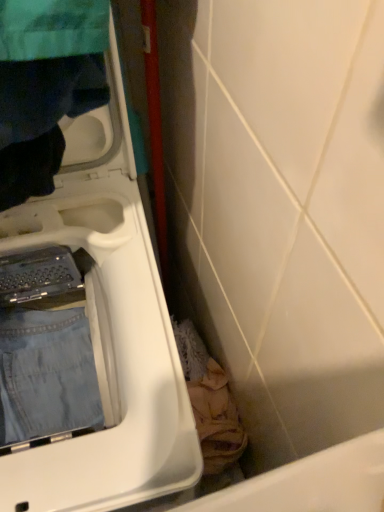
Describe the element at coordinates (108, 331) in the screenshot. The width and height of the screenshot is (384, 512). I see `white plastic washing machine at lower left` at that location.

Where is `white plastic washing machine at lower left`? Image resolution: width=384 pixels, height=512 pixels. white plastic washing machine at lower left is located at coordinates (108, 331).

Find the location of a particular element. white plastic washing machine at lower left is located at coordinates (108, 331).